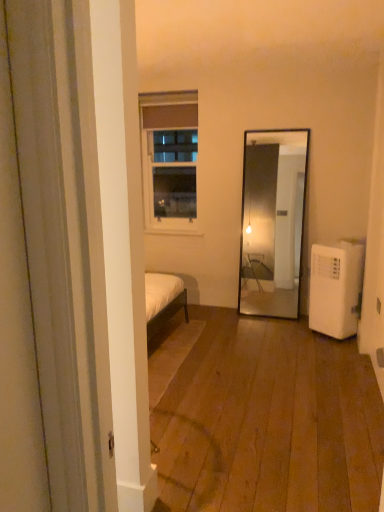
Question: Can white glass window at upper center be found inside white plastic air conditioner at lower right?

Choices:
 (A) no
 (B) yes

Answer: (A)

Question: Can you confirm if white plastic air conditioner at lower right is positioned to the right of white glass window at upper center?

Choices:
 (A) no
 (B) yes

Answer: (B)

Question: Considering the relative sizes of white plastic air conditioner at lower right and white glass window at upper center in the image provided, is white plastic air conditioner at lower right bigger than white glass window at upper center?

Choices:
 (A) yes
 (B) no

Answer: (A)

Question: Is white plastic air conditioner at lower right oriented away from white glass window at upper center?

Choices:
 (A) no
 (B) yes

Answer: (A)

Question: Is white plastic air conditioner at lower right facing towards white glass window at upper center?

Choices:
 (A) no
 (B) yes

Answer: (B)

Question: From the image's perspective, is white plastic air conditioner at lower right located beneath white glass window at upper center?

Choices:
 (A) yes
 (B) no

Answer: (A)

Question: From a real-world perspective, is white glass window at upper center positioned under white plastic air conditioner at lower right based on gravity?

Choices:
 (A) no
 (B) yes

Answer: (A)

Question: Is white glass window at upper center facing towards white plastic air conditioner at lower right?

Choices:
 (A) yes
 (B) no

Answer: (B)

Question: Does white glass window at upper center appear on the left side of white plastic air conditioner at lower right?

Choices:
 (A) yes
 (B) no

Answer: (A)

Question: Does white glass window at upper center appear on the right side of white plastic air conditioner at lower right?

Choices:
 (A) yes
 (B) no

Answer: (B)

Question: Are white glass window at upper center and white plastic air conditioner at lower right beside each other?

Choices:
 (A) yes
 (B) no

Answer: (B)

Question: From the image's perspective, does white glass window at upper center appear lower than white plastic air conditioner at lower right?

Choices:
 (A) yes
 (B) no

Answer: (B)

Question: In terms of size, does white glass window at upper center appear bigger or smaller than white plastic air conditioner at lower right?

Choices:
 (A) big
 (B) small

Answer: (B)